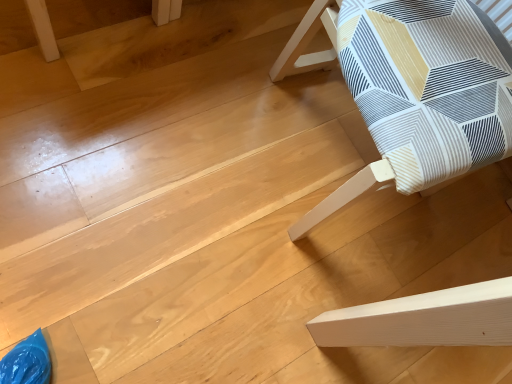
Question: Should I look upward or downward to see white fabric chair at right, placed as the first furniture when sorted from right to left?

Choices:
 (A) up
 (B) down

Answer: (A)

Question: From a real-world perspective, is white fabric chair at right, which is the second furniture in left-to-right order, on light brown wood table at upper left, which appears as the second furniture when viewed from the right?

Choices:
 (A) no
 (B) yes

Answer: (B)

Question: Can you confirm if white fabric chair at right, which is the second furniture in left-to-right order, is wider than light brown wood table at upper left, which appears as the second furniture when viewed from the right?

Choices:
 (A) no
 (B) yes

Answer: (B)

Question: Is white fabric chair at right, which is the second furniture in left-to-right order, facing towards light brown wood table at upper left, the 1th furniture from the left?

Choices:
 (A) yes
 (B) no

Answer: (B)

Question: Is white fabric chair at right, which is the second furniture in left-to-right order, closer to the viewer compared to light brown wood table at upper left, the 1th furniture from the left?

Choices:
 (A) no
 (B) yes

Answer: (B)

Question: Is white fabric chair at right, which is the second furniture in left-to-right order, looking in the opposite direction of light brown wood table at upper left, which appears as the second furniture when viewed from the right?

Choices:
 (A) no
 (B) yes

Answer: (A)

Question: Can you confirm if white fabric chair at right, which is the second furniture in left-to-right order, is shorter than light brown wood table at upper left, which appears as the second furniture when viewed from the right?

Choices:
 (A) no
 (B) yes

Answer: (A)

Question: Would you say white fabric chair at right, placed as the first furniture when sorted from right to left, is part of light brown wood table at upper left, the 1th furniture from the left,'s contents?

Choices:
 (A) yes
 (B) no

Answer: (B)

Question: Is light brown wood table at upper left, the 1th furniture from the left, oriented towards white fabric chair at right, which is the second furniture in left-to-right order?

Choices:
 (A) yes
 (B) no

Answer: (A)

Question: Does light brown wood table at upper left, the 1th furniture from the left, have a greater height compared to white fabric chair at right, which is the second furniture in left-to-right order?

Choices:
 (A) yes
 (B) no

Answer: (B)

Question: From a real-world perspective, is light brown wood table at upper left, which appears as the second furniture when viewed from the right, below white fabric chair at right, which is the second furniture in left-to-right order?

Choices:
 (A) yes
 (B) no

Answer: (A)

Question: Can you confirm if light brown wood table at upper left, the 1th furniture from the left, is shorter than white fabric chair at right, which is the second furniture in left-to-right order?

Choices:
 (A) no
 (B) yes

Answer: (B)

Question: Is light brown wood table at upper left, the 1th furniture from the left, to the right of white fabric chair at right, placed as the first furniture when sorted from right to left, from the viewer's perspective?

Choices:
 (A) no
 (B) yes

Answer: (A)

Question: Based on their sizes in the image, would you say white fabric chair at right, placed as the first furniture when sorted from right to left, is bigger or smaller than light brown wood table at upper left, which appears as the second furniture when viewed from the right?

Choices:
 (A) big
 (B) small

Answer: (A)